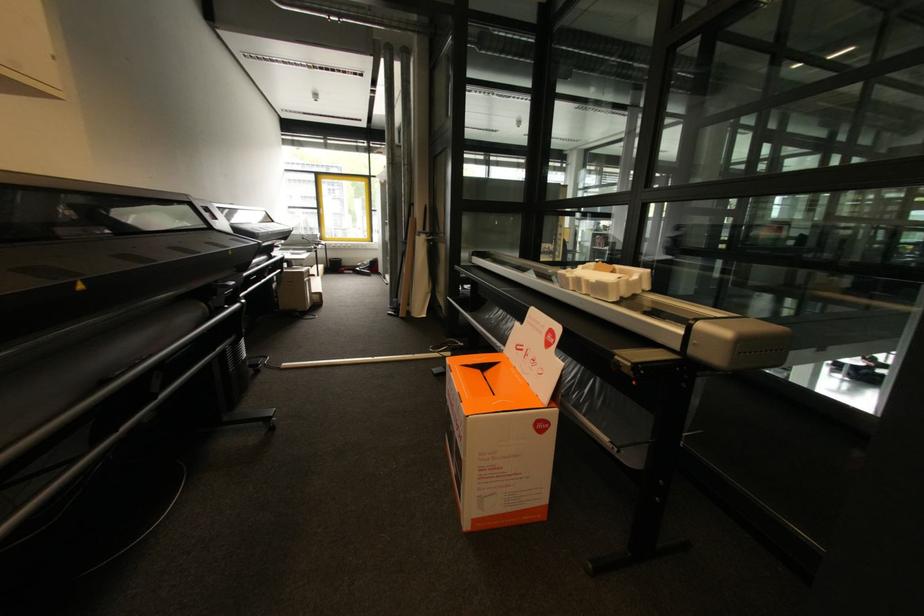
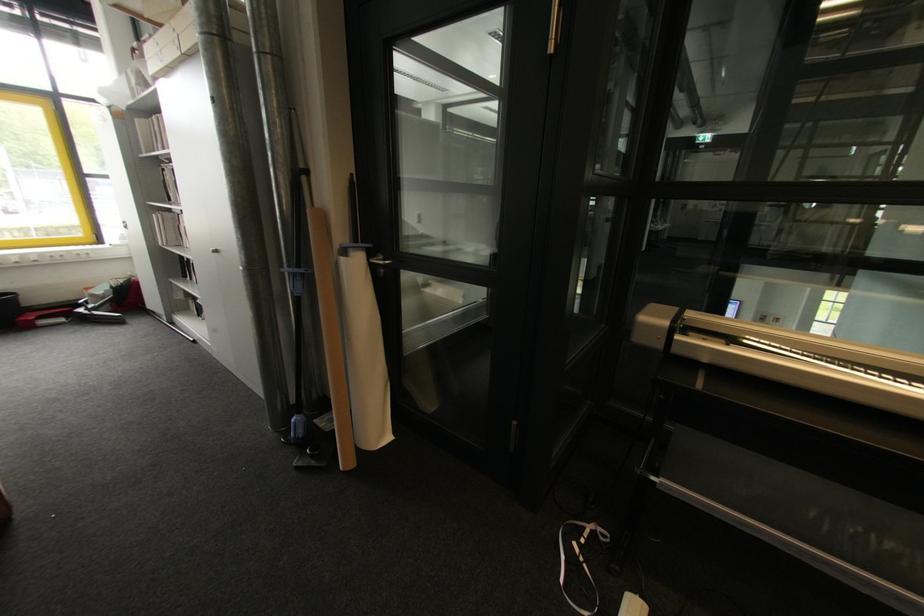
The point at (355, 273) is marked in the first image. Where is the corresponding point in the second image?

(66, 321)